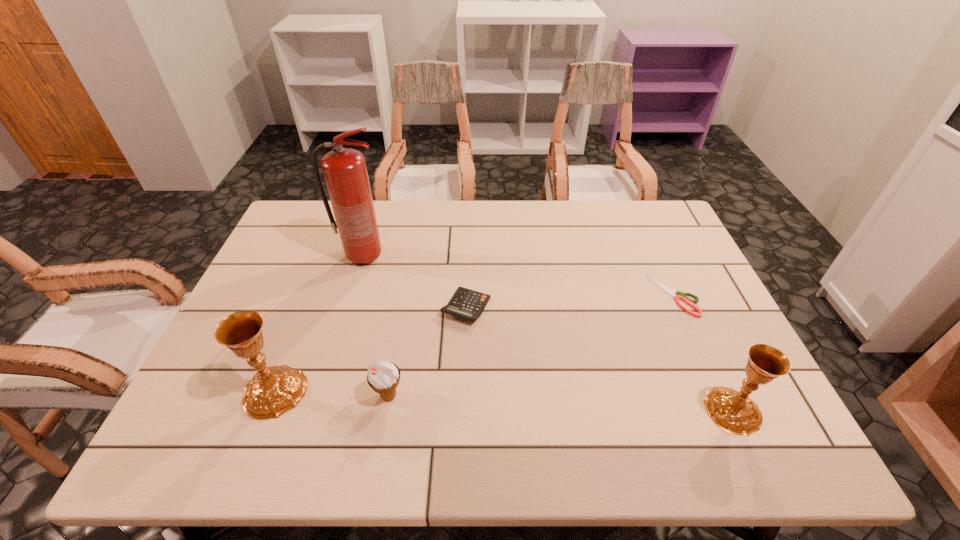
To achieve uniform spacing by inserting another chalice among them, please point to a free space for this new chalice. Please provide its 2D coordinates. Your answer should be formatted as a tuple, i.e. [(x, y)], where the tuple contains the x and y coordinates of a point satisfying the conditions above.

[(500, 401)]